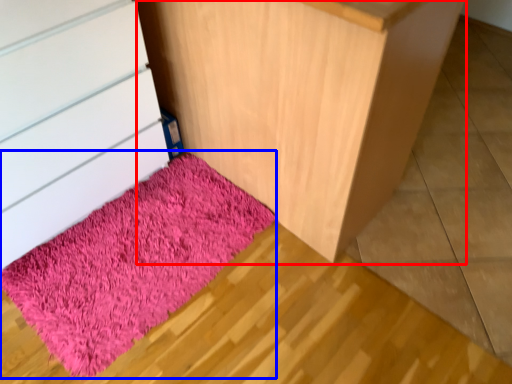
Question: Which point is closer to the camera, furniture (highlighted by a red box) or mat (highlighted by a blue box)?

Choices:
 (A) furniture
 (B) mat

Answer: (A)